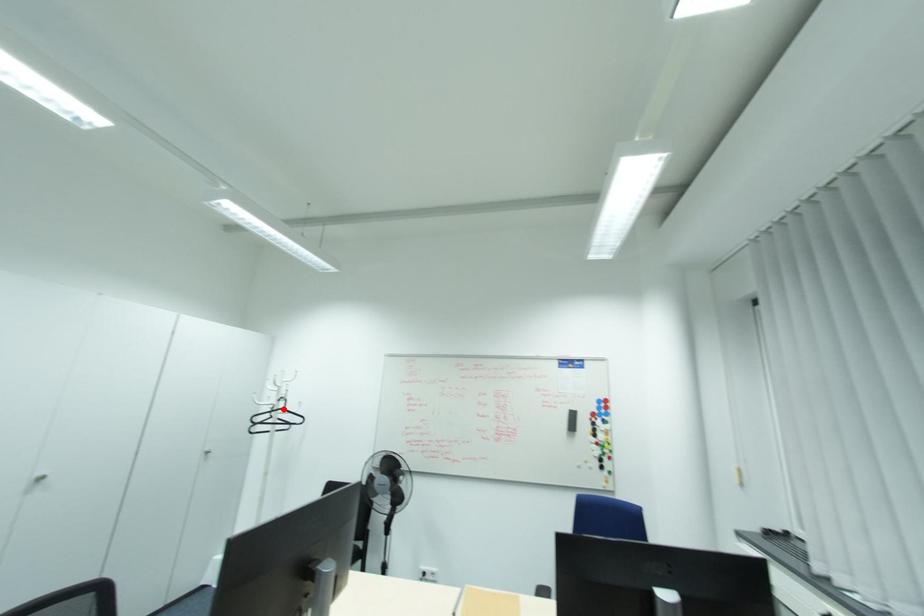
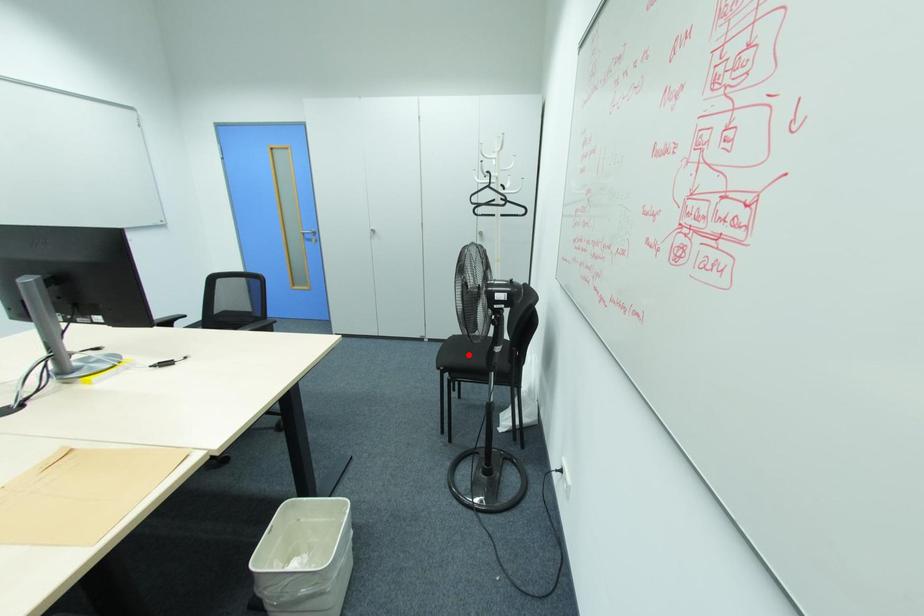
I am providing you with two images of the same scene from different viewpoints. A red point is marked on the first image and another point is marked on the second image. Is the red point in image1 aligned with the point shown in image2?

No